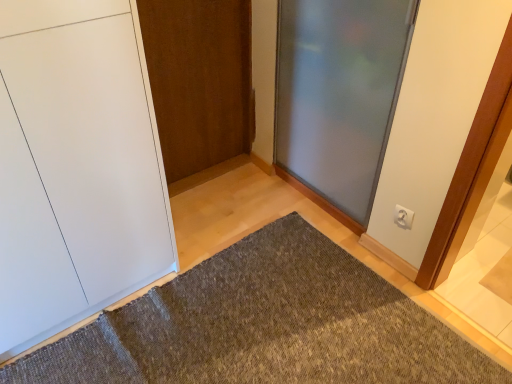
You are a GUI agent. You are given a task and a screenshot of the screen. Output one action in this format:
    pyautogui.click(x=<x>, y=<y>)
    Task: Click on the free spot in front of wooden door at center, which is counted as the 2th door, starting from the right
    
    Given the screenshot: What is the action you would take?
    pyautogui.click(x=212, y=203)